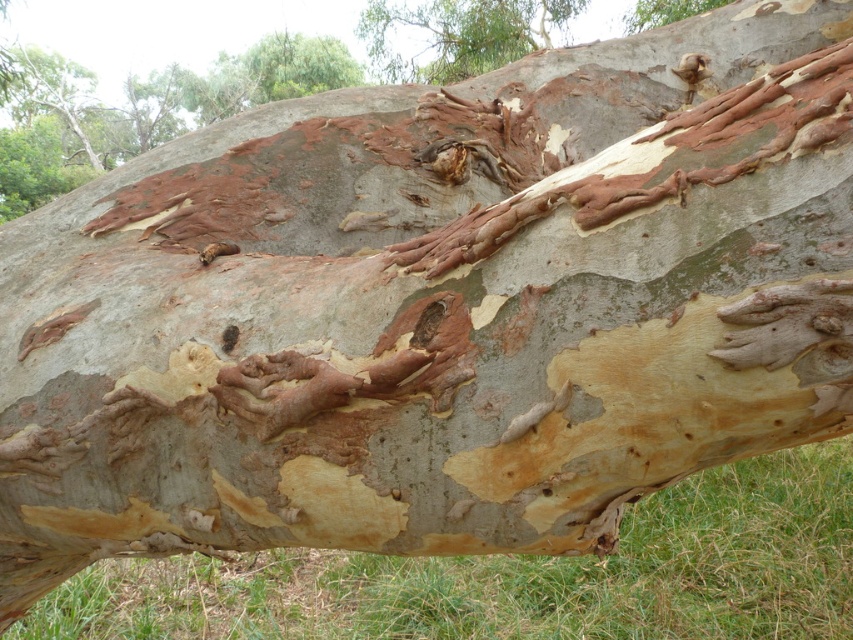
From the picture: You are a hiker standing in front of the tree trunk. You notice two points marked on the trunk at coordinates point (x=517, y=44) and point (x=724, y=3). If you want to touch the point closer to you, which coordinate should you reach for?

You should reach for point (x=517, y=44) because it is closer to you than point (x=724, y=3).

You are an arborist examining the tree trunk. You notice two areas labeled as smooth bark tree trunk at upper center and smooth brown bark at upper center. Which area has a bigger size?

The smooth bark tree trunk at upper center has a larger size compared to the smooth brown bark at upper center.